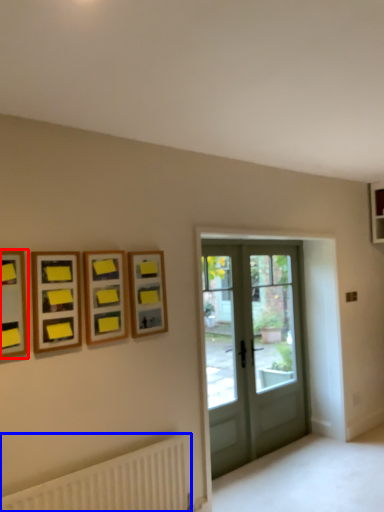
Question: Which point is further to the camera, picture frame (highlighted by a red box) or radiator (highlighted by a blue box)?

Choices:
 (A) picture frame
 (B) radiator

Answer: (A)